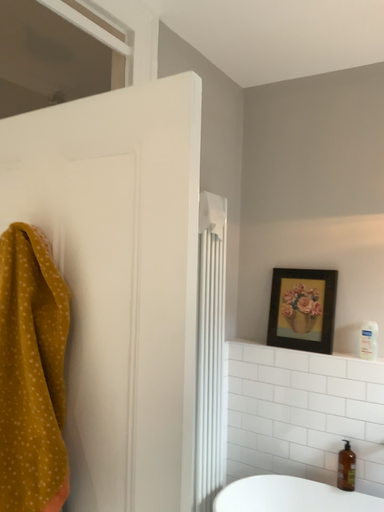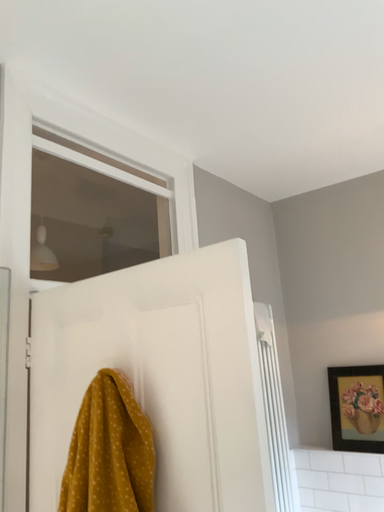
Question: How did the camera likely rotate when shooting the video?

Choices:
 (A) rotated upward
 (B) rotated downward

Answer: (A)